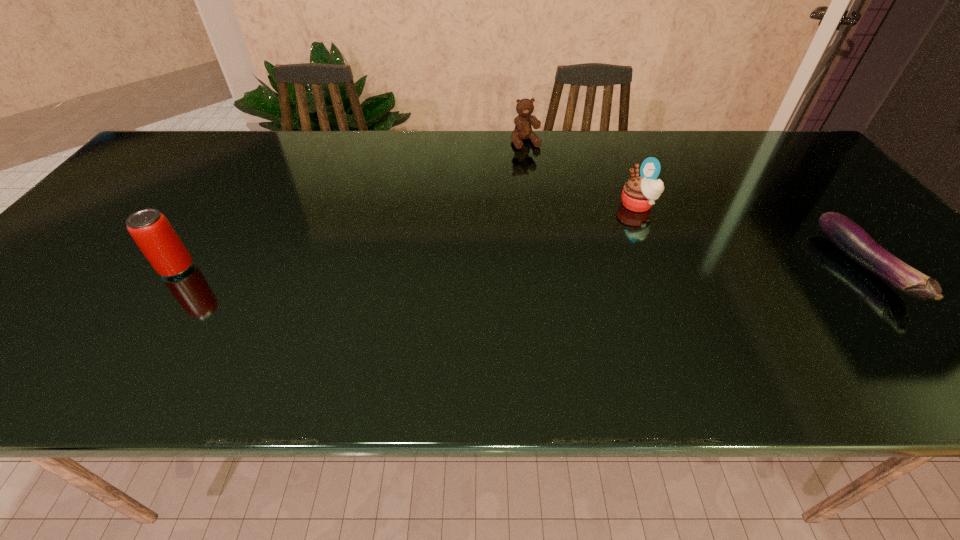
What are the coordinates of `beer can` in the screenshot? It's located at (150, 229).

Locate an element on the screen. The height and width of the screenshot is (540, 960). eggplant is located at coordinates (852, 240).

This screenshot has height=540, width=960. Identify the location of the shortest object. (852, 240).

At what (x,y) coordinates should I click in order to perform the action: click on the third object from right to left. Please return your answer as a coordinate pair (x, y). This screenshot has width=960, height=540. Looking at the image, I should click on (523, 130).

Find the location of `the farthest object`. the farthest object is located at coordinates (523, 130).

Image resolution: width=960 pixels, height=540 pixels. In order to click on the third nearest object in this screenshot , I will do `click(639, 194)`.

The width and height of the screenshot is (960, 540). I want to click on the second object from right to left, so click(x=639, y=194).

At what (x,y) coordinates should I click in order to perform the action: click on free location located on the back of the leftmost object. Please return your answer as a coordinate pair (x, y). This screenshot has width=960, height=540. Looking at the image, I should click on (240, 175).

At what (x,y) coordinates should I click in order to perform the action: click on free space located on the back of the eggplant. Please return your answer as a coordinate pair (x, y). The width and height of the screenshot is (960, 540). Looking at the image, I should click on (767, 154).

Locate an element on the screen. This screenshot has width=960, height=540. vacant space located 0.200m on the face of the second object from left to right is located at coordinates (549, 187).